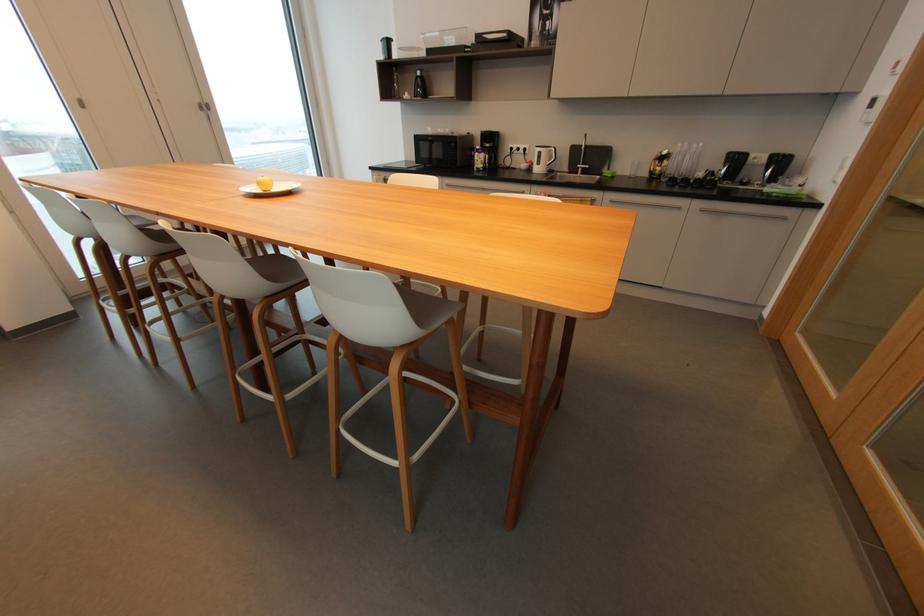
Where would you lift the yellow apple? Please return your answer as a coordinate pair (x, y).

(263, 183)